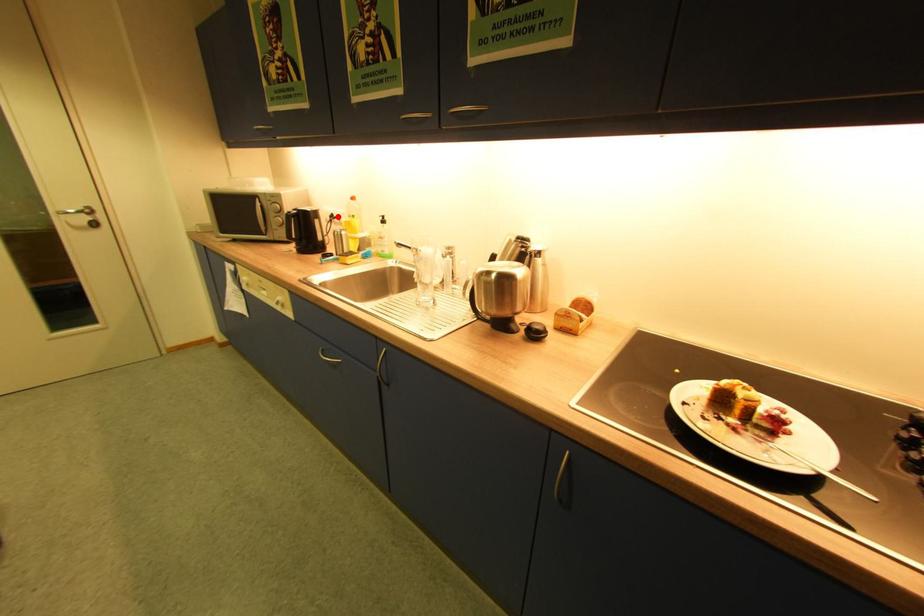
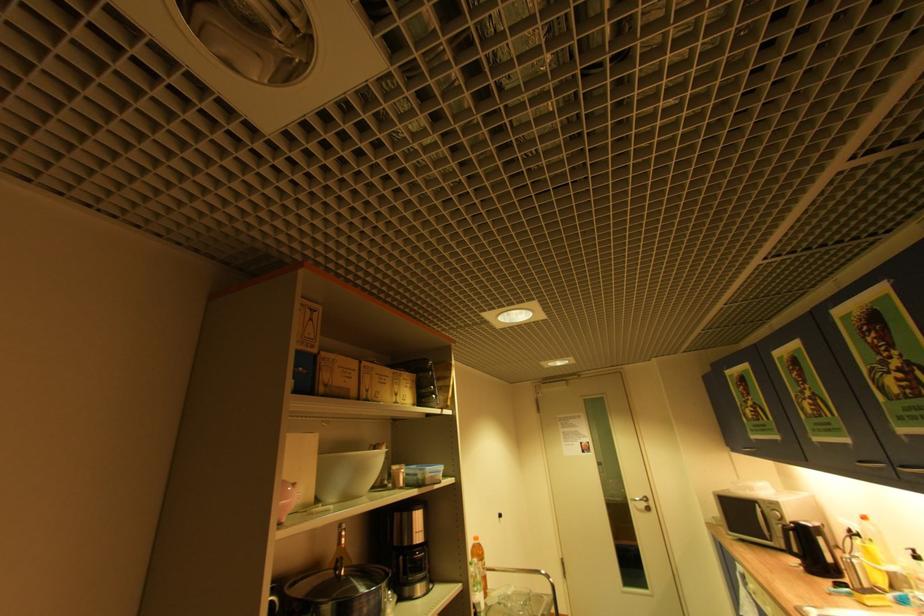
Find the pixel in the second image that matches the highlighted location in the first image.

(856, 532)